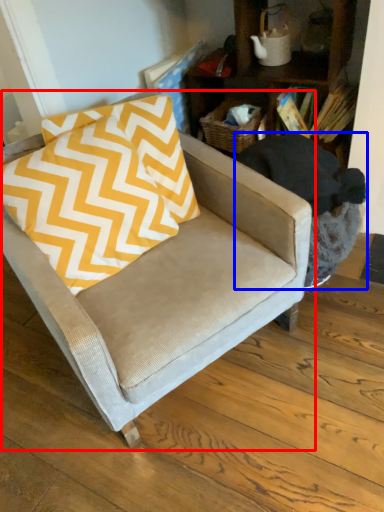
Question: Which of the following is the farthest to the observer, chair (highlighted by a red box) or swivel chair (highlighted by a blue box)?

Choices:
 (A) chair
 (B) swivel chair

Answer: (B)